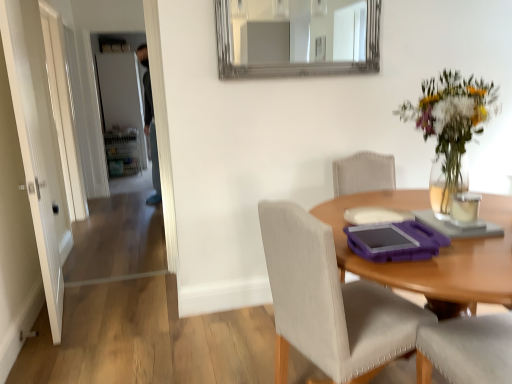
This screenshot has height=384, width=512. Identify the location of free space below white glossy door at left (from a real-world perspective). point(77,225).